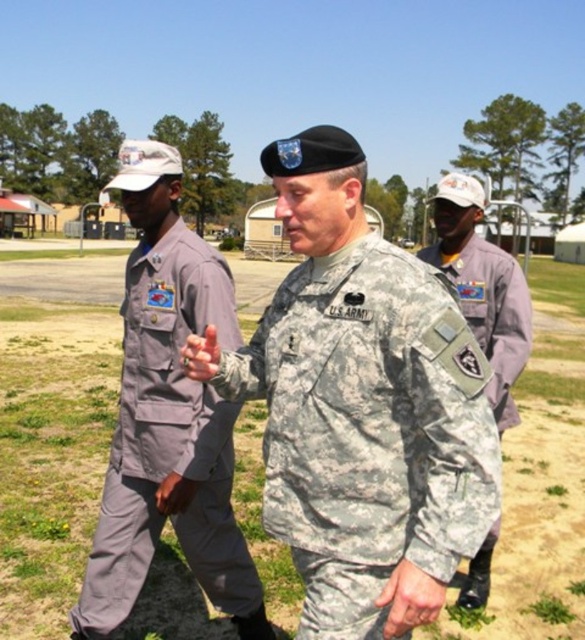
Based on the scene description, which individual is positioned lower in the image, the gray fabric uniform at left or the camouflage fabric uniform at center?

The gray fabric uniform at left is positioned under the camouflage fabric uniform at center, so the gray fabric uniform at left is lower in the image.

You are a photographer trying to capture a group photo of the gray fabric uniform at left and the camouflage fabric uniform at center. Since you want both subjects to be centered in the frame, which direction should you move the camera to align them properly?

The gray fabric uniform at left is positioned on the left side of camouflage fabric uniform at center. To center both subjects in the frame, move the camera slightly to the left so that the gray fabric uniform at left and the camouflage fabric uniform at center are aligned centrally.

You are standing in the scene and want to touch the point at coordinates point (x=359, y=544). Can you reach it without moving your body?

The point (x=359, y=544) is 1.68 meters away from the viewer. Since the average human arm length is about 0.7 meters, you cannot reach it without moving your body.